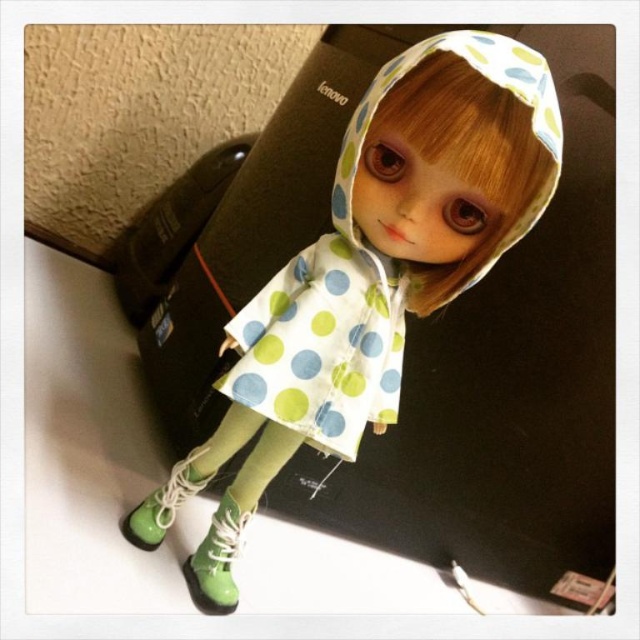
Question: Is white polka dot fabric at center to the left of green glossy boot at lower left from the viewer's perspective?

Choices:
 (A) yes
 (B) no

Answer: (B)

Question: Can you confirm if white polka dot fabric at center is thinner than polka dot fabric dress at center?

Choices:
 (A) yes
 (B) no

Answer: (B)

Question: Which of these objects is positioned farthest from the polka dot fabric dress at center?

Choices:
 (A) green glossy boot at lower left
 (B) green rubber boot at lower left
 (C) white polka dot fabric at center

Answer: (A)

Question: Is polka dot fabric dress at center further to the viewer compared to green rubber boot at lower left?

Choices:
 (A) no
 (B) yes

Answer: (A)

Question: Which of the following is the farthest from the observer?

Choices:
 (A) green rubber boot at lower left
 (B) white polka dot fabric at center
 (C) polka dot fabric dress at center

Answer: (A)

Question: Which object is positioned closest to the green rubber boot at lower left?

Choices:
 (A) green glossy boot at lower left
 (B) polka dot fabric dress at center
 (C) white polka dot fabric at center

Answer: (A)